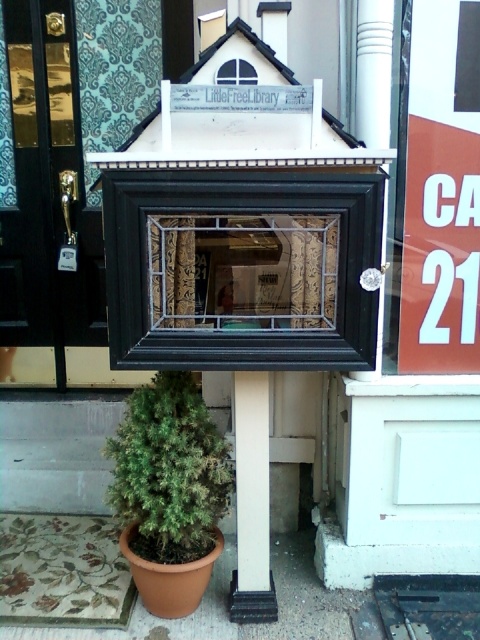
You are standing in front of the Little Free Library and notice a black wood frame at center and a green matte plant at lower left. Which object is bigger?

The black wood frame at center is larger in size compared to the green matte plant at lower left.

You are a visitor at the Little Free Library and want to read the orange paper sign at right. Since you are of average height, can you easily see it without needing to stand on something? Please explain using the clear glass window at center.

The orange paper sign at right is located below the clear glass window at center, so it is positioned lower than the window. Since it is below the window, it should be at a height that is easily visible to someone of average height without needing to stand on something.